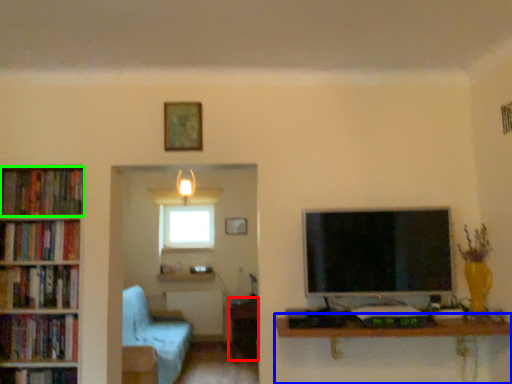
Question: Considering the real-world distances, which object is closest to table (highlighted by a red box)? table (highlighted by a blue box) or book (highlighted by a green box).

Choices:
 (A) table
 (B) book

Answer: (A)